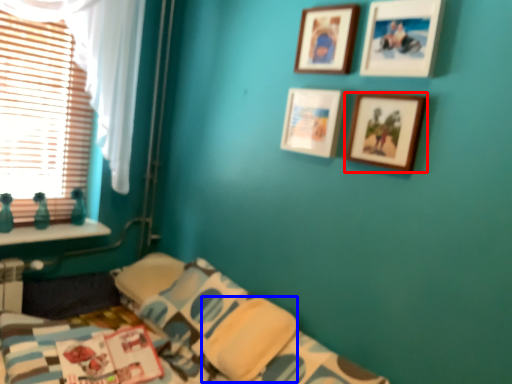
Question: Which object appears farthest to the camera in this image, picture frame (highlighted by a red box) or pillow (highlighted by a blue box)?

Choices:
 (A) picture frame
 (B) pillow

Answer: (B)